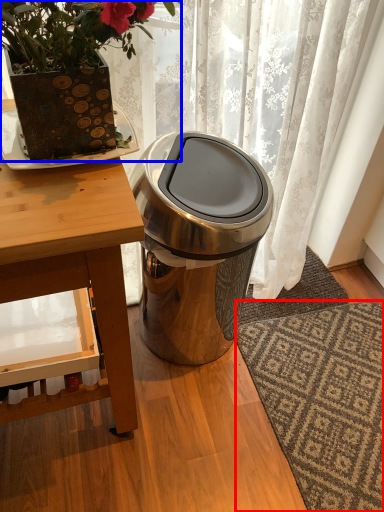
Question: Among these objects, which one is farthest to the camera, doormat (highlighted by a red box) or houseplant (highlighted by a blue box)?

Choices:
 (A) doormat
 (B) houseplant

Answer: (A)